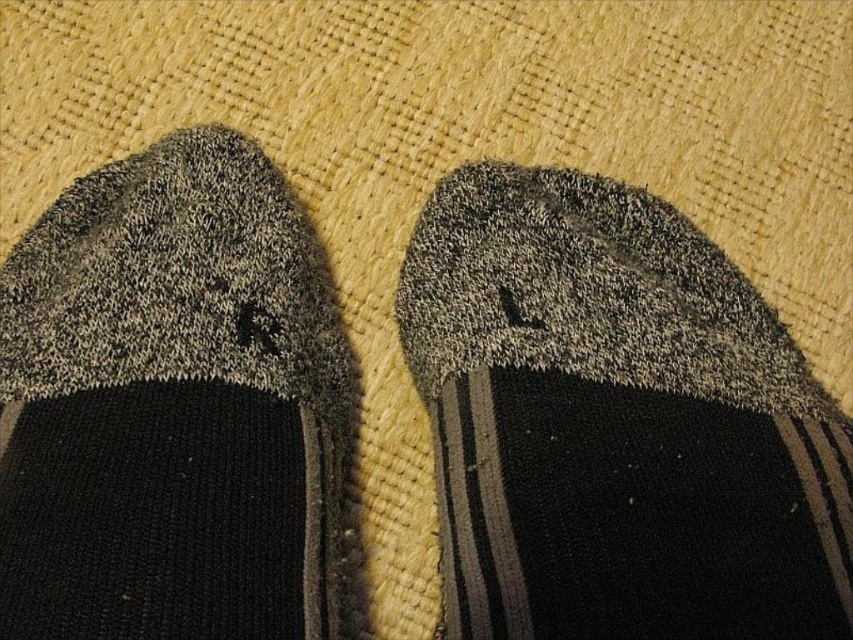
You are holding a measuring tape and want to measure the distance from your eyes to a specific point in the image. The scene shows two socks on a textured surface. The left sock is labeled R, and the right sock is labeled L. There is a point at coordinates point (850, 561). Can you determine if this point is closer to your eyes than 1 meter?

The distance between point (850, 561) and the camera is 75.90 centimeters. Since 75.90 centimeters is less than 1 meter, the point is closer to your eyes than 1 meter.

You are organizing your drawer and have two socks to place. You have a textured gray sock at center and a knit fabric sock at left. Which sock should you fold first to ensure they both fit in the drawer?

The textured gray sock at center occupies less space than the knit fabric sock at left, so you should fold the knit fabric sock at left first to ensure both fit in the drawer.